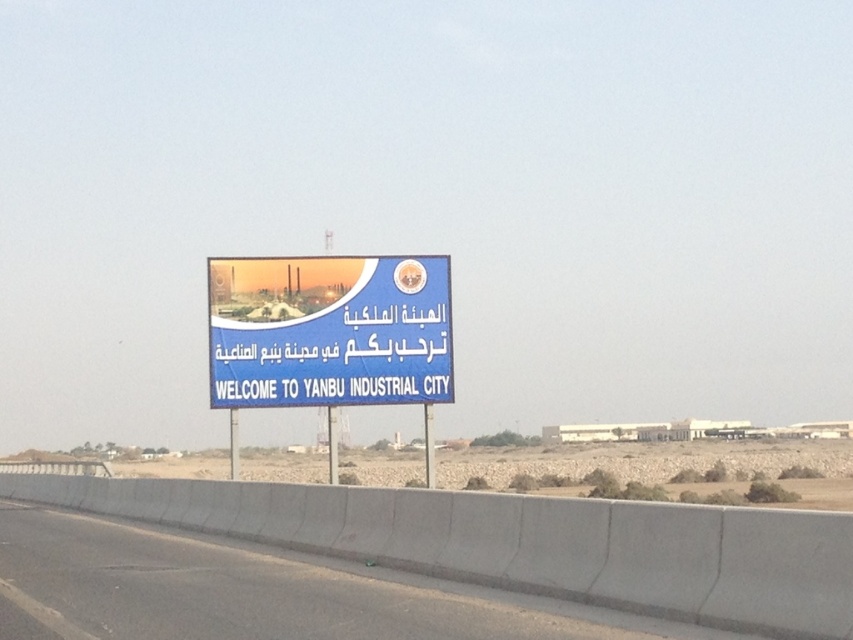
You are driving on a highway and see the billboard. There is a gray concrete barrier at lower center and a blue plastic signboard at center. Which object is closer to the road surface?

The gray concrete barrier at lower center is closer to the road surface because it is positioned below the blue plastic signboard at center.

You are a photographer standing at the base of the billboard. You want to take a photo that includes both point (453,628) and point (355,352). Which point will appear larger in your photo?

Point (453,628) will appear larger in the photo because it is closer to the camera than point (355,352).